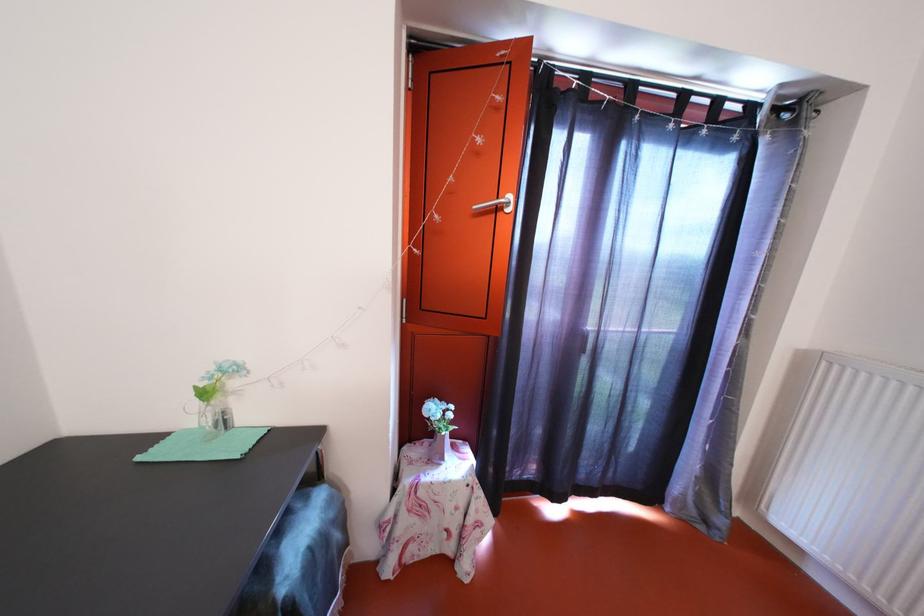
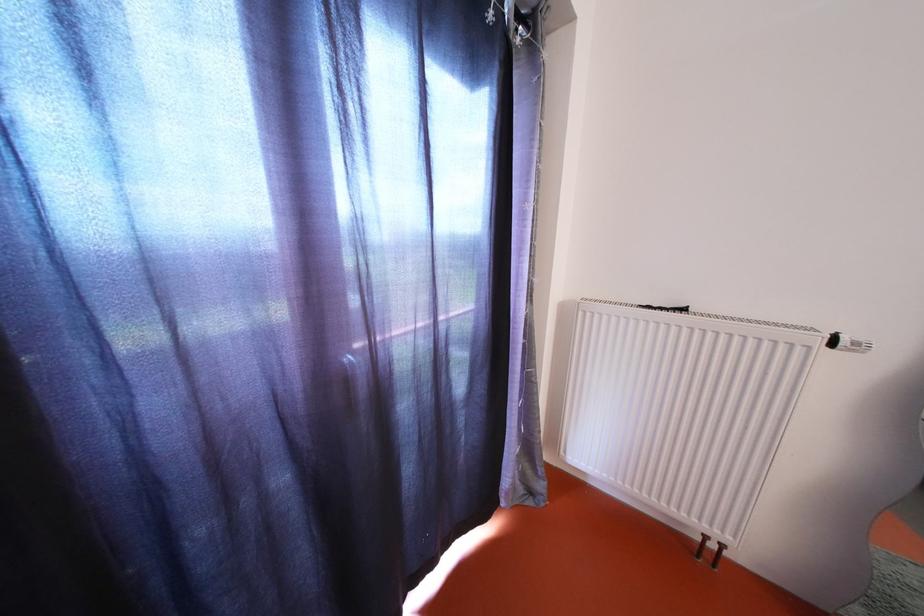
Question: The images are taken continuously from a first-person perspective. In which direction is your viewpoint rotating?

Choices:
 (A) Left
 (B) Right
 (C) Up
 (D) Down

Answer: (B)